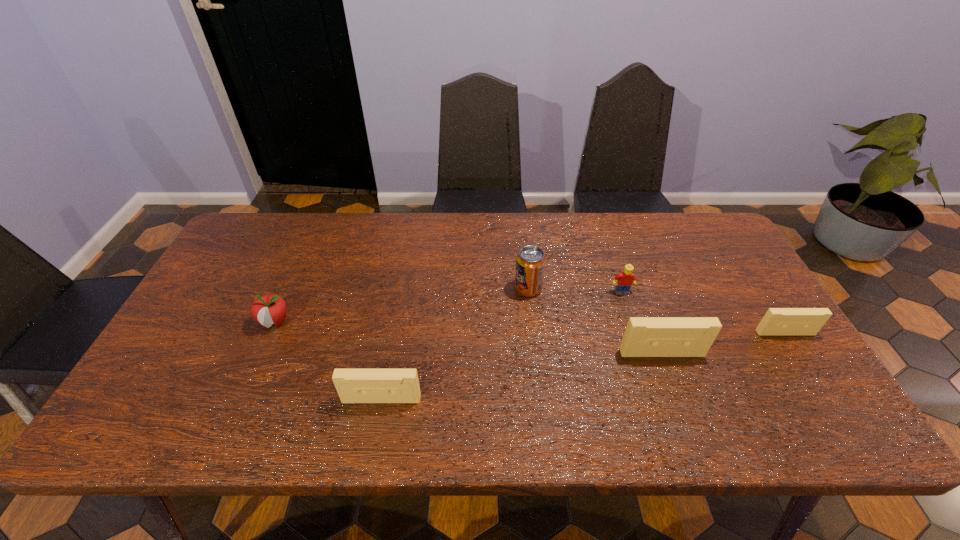
What are the coordinates of `vacant space located on the back of the leftmost object` in the screenshot? It's located at (318, 224).

I want to click on free space located on the front-facing side of the Lego, so click(x=657, y=402).

Identify the location of vacant space located on the left of the soda can. (390, 289).

Where is `object at the near edge`? The height and width of the screenshot is (540, 960). object at the near edge is located at coordinates (353, 385).

Locate an element on the screen. The width and height of the screenshot is (960, 540). object at the right edge is located at coordinates (777, 321).

The image size is (960, 540). In the image, there is a desktop. What are the coordinates of `free space at the far edge` in the screenshot? It's located at (635, 254).

This screenshot has height=540, width=960. What are the coordinates of `free space at the near edge` in the screenshot? It's located at (278, 393).

Image resolution: width=960 pixels, height=540 pixels. I want to click on vacant space at the left edge, so click(x=246, y=266).

In the image, there is a desktop. Where is `free space at the right edge`? This screenshot has height=540, width=960. free space at the right edge is located at coordinates (745, 345).

Where is `vacant space at the near left corner`? Image resolution: width=960 pixels, height=540 pixels. vacant space at the near left corner is located at coordinates (203, 383).